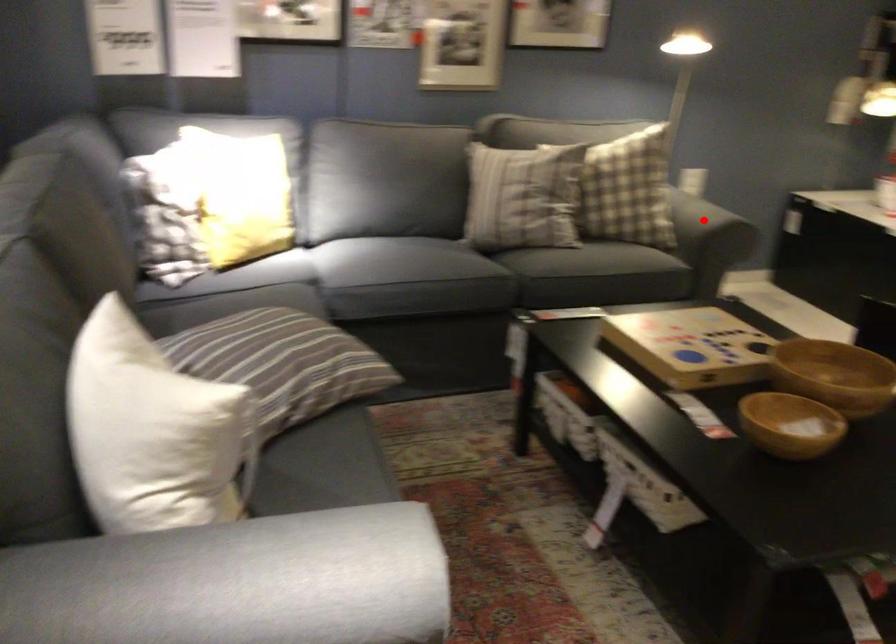
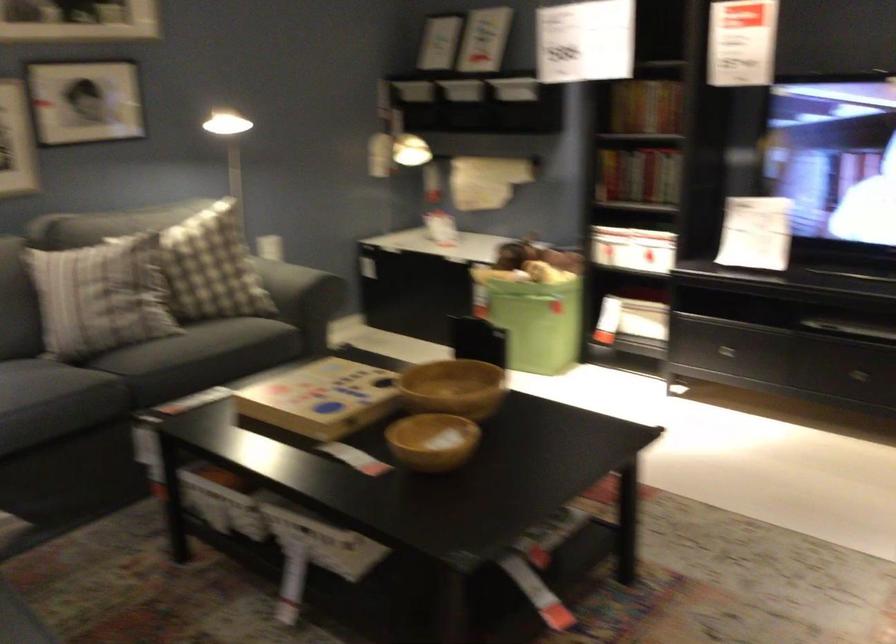
Question: I am providing you with two images of the same scene from different viewpoints. Given a red point in image1, look at the same physical point in image2. Is it:

Choices:
 (A) Closer to the viewpoint
 (B) Farther from the viewpoint

Answer: (B)